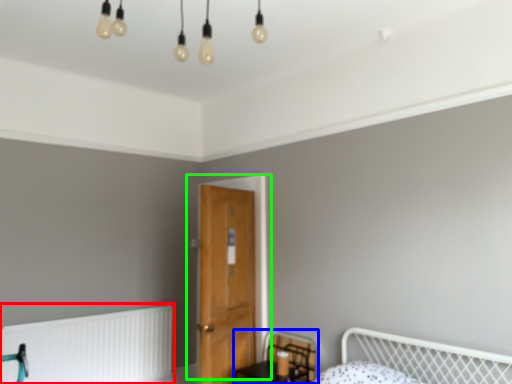
Question: Which object is the farthest from radiator (highlighted by a red box)? Choose among these: swivel chair (highlighted by a blue box) or door (highlighted by a green box).

Choices:
 (A) swivel chair
 (B) door

Answer: (B)